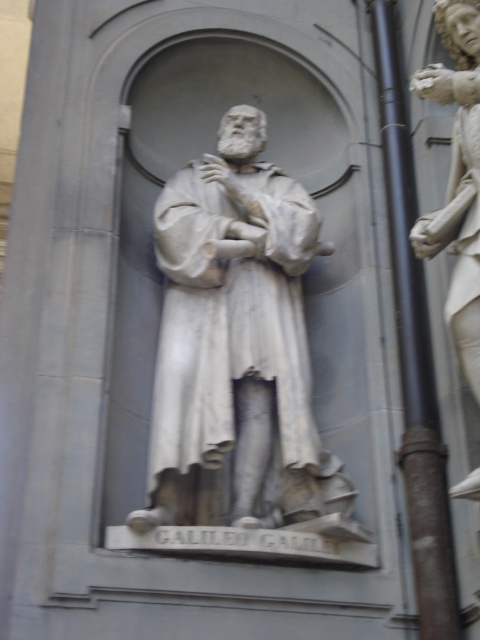
You are an art conservator assessing the placement of the white marble statue at center. Based on its coordinates at point 0.534, 0.492, can you determine if it is positioned centrally within the arched recess?

The white marble statue at center is located at coordinates (236, 340), which indicates it is positioned centrally within the arched recess as the coordinates are close to the center point of the image.

You are standing in front of the building where the statue is located. There is a point at coordinates (236,340). What is located at that point?

At point (236,340) lies the white marble statue at center.

You are a photographer standing in front of the statue of Galileo Galilei. You want to take a photo that includes both the black metal pole at right and the white marble statue at right. Which object should you position closer to the bottom of the frame to ensure both are fully visible?

The white marble statue at right is shorter than the black metal pole at right. To ensure both are fully visible in the photo, position the white marble statue at right closer to the bottom of the frame since it is shorter and will occupy less vertical space.